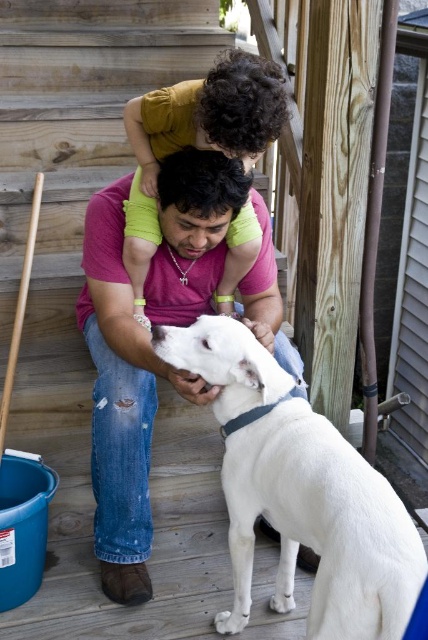
Can you confirm if white matte dog at center is thinner than matte pink shirt at center?

Correct, white matte dog at center's width is less than matte pink shirt at center's.

Can you confirm if white matte dog at center is taller than matte pink shirt at center?

In fact, white matte dog at center may be shorter than matte pink shirt at center.

This screenshot has height=640, width=428. What are the coordinates of `white matte dog at center` in the screenshot? It's located at (300, 492).

You are a GUI agent. You are given a task and a screenshot of the screen. Output one action in this format:
    pyautogui.click(x=<x>, y=<y>)
    Task: Click on the white matte dog at center
    
    Given the screenshot: What is the action you would take?
    pyautogui.click(x=300, y=492)